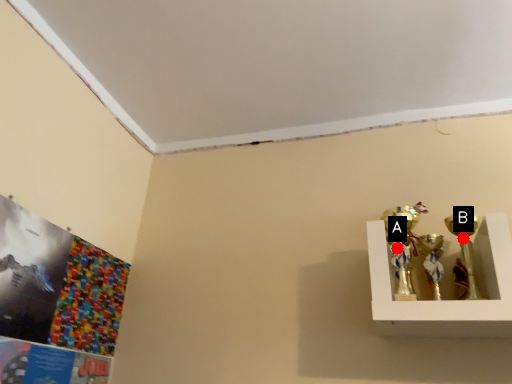
Question: Two points are circled on the image, labeled by A and B beside each circle. Which point is closer to the camera?

Choices:
 (A) A is closer
 (B) B is closer

Answer: (B)